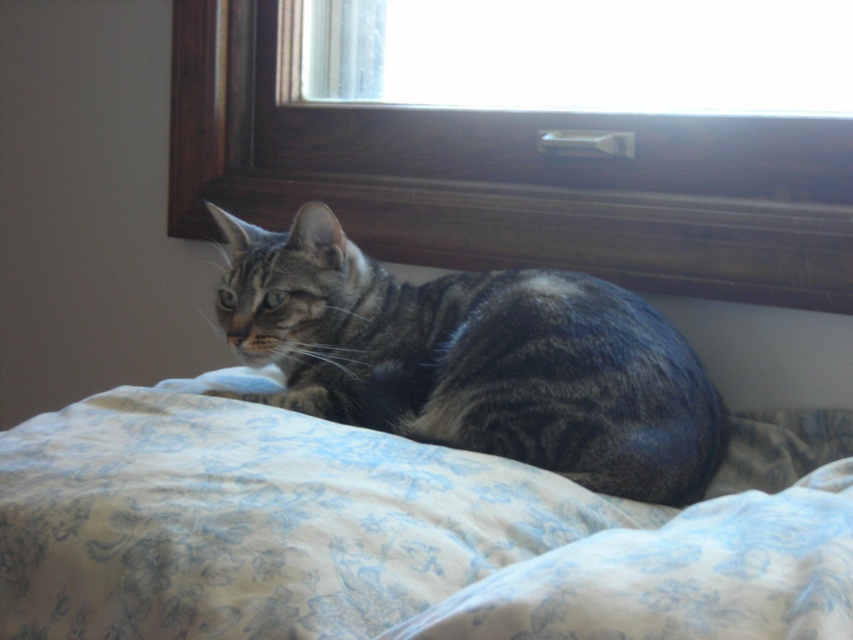
Question: Is floral-patterned fabric at lower center in front of tabby fur cat at center?

Choices:
 (A) no
 (B) yes

Answer: (B)

Question: Which of the following is the closest to the observer?

Choices:
 (A) floral-patterned fabric at lower center
 (B) transparent glass window at upper center
 (C) tabby fur cat at center

Answer: (A)

Question: Which object appears closest to the camera in this image?

Choices:
 (A) floral-patterned fabric at lower center
 (B) transparent glass window at upper center
 (C) tabby fur cat at center

Answer: (A)

Question: Which object is farther from the camera taking this photo?

Choices:
 (A) tabby fur cat at center
 (B) floral-patterned fabric at lower center
 (C) transparent glass window at upper center

Answer: (C)

Question: Does tabby fur cat at center have a smaller size compared to transparent glass window at upper center?

Choices:
 (A) yes
 (B) no

Answer: (A)

Question: In this image, where is floral-patterned fabric at lower center located relative to tabby fur cat at center?

Choices:
 (A) left
 (B) right

Answer: (B)